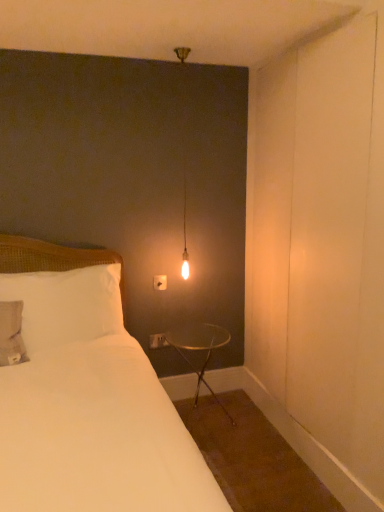
Question: Is white fabric bed at left oriented away from clear glass table at lower right?

Choices:
 (A) no
 (B) yes

Answer: (A)

Question: Does white fabric bed at left touch clear glass table at lower right?

Choices:
 (A) yes
 (B) no

Answer: (B)

Question: Does white fabric bed at left lie behind clear glass table at lower right?

Choices:
 (A) yes
 (B) no

Answer: (B)

Question: Is white fabric bed at left wider than clear glass table at lower right?

Choices:
 (A) no
 (B) yes

Answer: (B)

Question: Considering the relative positions of white fabric bed at left and clear glass table at lower right in the image provided, is white fabric bed at left in front of clear glass table at lower right?

Choices:
 (A) yes
 (B) no

Answer: (A)

Question: Is white fabric bed at left to the left of clear glass table at lower right from the viewer's perspective?

Choices:
 (A) yes
 (B) no

Answer: (A)

Question: Is white soft pillow at left positioned before clear glass table at lower right?

Choices:
 (A) yes
 (B) no

Answer: (A)

Question: Is the position of white soft pillow at left more distant than that of clear glass table at lower right?

Choices:
 (A) yes
 (B) no

Answer: (B)

Question: Is white soft pillow at left not within clear glass table at lower right?

Choices:
 (A) no
 (B) yes

Answer: (B)

Question: Is white soft pillow at left beside clear glass table at lower right?

Choices:
 (A) no
 (B) yes

Answer: (A)

Question: From a real-world perspective, is white soft pillow at left below clear glass table at lower right?

Choices:
 (A) no
 (B) yes

Answer: (A)

Question: Can you confirm if white soft pillow at left is shorter than clear glass table at lower right?

Choices:
 (A) no
 (B) yes

Answer: (B)

Question: Is white soft pillow at left positioned far away from white fabric bed at left?

Choices:
 (A) no
 (B) yes

Answer: (A)